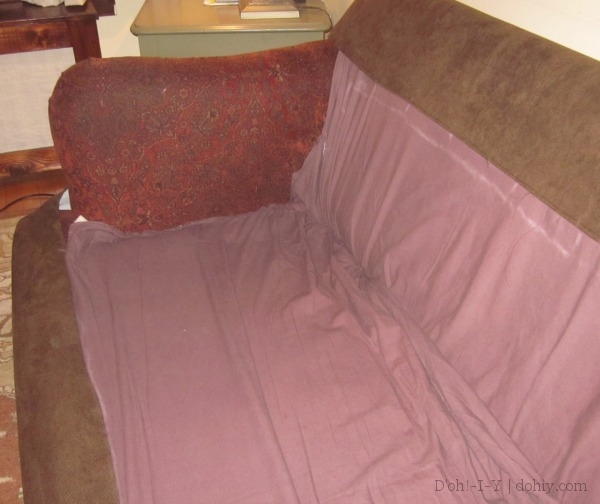
What are the coordinates of `lamp` in the screenshot? It's located at [264, 8].